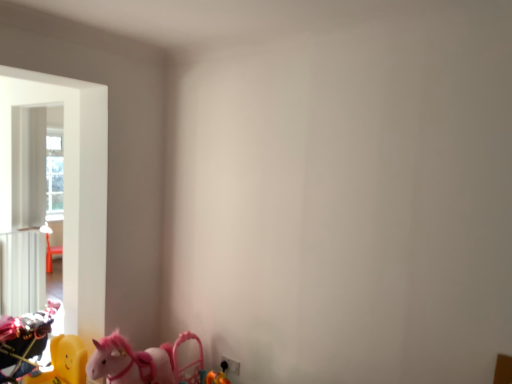
The height and width of the screenshot is (384, 512). What do you see at coordinates (24, 341) in the screenshot?
I see `shiny metallic motorcycle at left, which is counted as the 1th toy, starting from the left` at bounding box center [24, 341].

Where is `shiny metallic motorcycle at left, which is counted as the 1th toy, starting from the left`? The image size is (512, 384). shiny metallic motorcycle at left, which is counted as the 1th toy, starting from the left is located at coordinates point(24,341).

This screenshot has height=384, width=512. Describe the element at coordinates (64, 362) in the screenshot. I see `yellow plastic toy horse at lower left, positioned as the 1th toy in right-to-left order` at that location.

Where is `yellow plastic toy horse at lower left, positioned as the 1th toy in right-to-left order`? This screenshot has width=512, height=384. yellow plastic toy horse at lower left, positioned as the 1th toy in right-to-left order is located at coordinates (64, 362).

How much space does yellow plastic toy horse at lower left, positioned as the 1th toy in right-to-left order, occupy vertically?

The height of yellow plastic toy horse at lower left, positioned as the 1th toy in right-to-left order, is 15.76 inches.

Image resolution: width=512 pixels, height=384 pixels. What are the coordinates of `shiny metallic motorcycle at left, which is counted as the 1th toy, starting from the left` in the screenshot? It's located at (24, 341).

Is shiny metallic motorcycle at left, which is counted as the 1th toy, starting from the left, at the left side of yellow plastic toy horse at lower left, positioned as the 1th toy in right-to-left order?

Yes, shiny metallic motorcycle at left, which is counted as the 1th toy, starting from the left, is to the left of yellow plastic toy horse at lower left, positioned as the 1th toy in right-to-left order.

Is shiny metallic motorcycle at left, which is counted as the 1th toy, starting from the left, further to the viewer compared to yellow plastic toy horse at lower left, positioned as the 1th toy in right-to-left order?

Yes, the depth of shiny metallic motorcycle at left, which is counted as the 1th toy, starting from the left, is greater than that of yellow plastic toy horse at lower left, positioned as the 1th toy in right-to-left order.

Considering the points (2, 366) and (69, 380), which point is in front, point (2, 366) or point (69, 380)?

The point (69, 380) is closer.

From the image's perspective, is shiny metallic motorcycle at left, which is counted as the 1th toy, starting from the left, located above or below yellow plastic toy horse at lower left, the 2th toy when ordered from left to right?

shiny metallic motorcycle at left, which is counted as the 1th toy, starting from the left, is situated higher than yellow plastic toy horse at lower left, the 2th toy when ordered from left to right, in the image.

From a real-world perspective, between shiny metallic motorcycle at left, which is counted as the 1th toy, starting from the left, and yellow plastic toy horse at lower left, positioned as the 1th toy in right-to-left order, who is vertically lower?

In real-world perspective, yellow plastic toy horse at lower left, positioned as the 1th toy in right-to-left order, is lower.

Looking at their sizes, would you say shiny metallic motorcycle at left, which is counted as the 1th toy, starting from the left, is wider or thinner than yellow plastic toy horse at lower left, positioned as the 1th toy in right-to-left order?

shiny metallic motorcycle at left, which is counted as the 1th toy, starting from the left, is wider than yellow plastic toy horse at lower left, positioned as the 1th toy in right-to-left order.

Does shiny metallic motorcycle at left, which is counted as the 1th toy, starting from the left, have a lesser height compared to yellow plastic toy horse at lower left, positioned as the 1th toy in right-to-left order?

No.

Which of these two, shiny metallic motorcycle at left, which is counted as the 2th toy, starting from the right, or yellow plastic toy horse at lower left, the 2th toy when ordered from left to right, is bigger?

shiny metallic motorcycle at left, which is counted as the 2th toy, starting from the right.

Is shiny metallic motorcycle at left, which is counted as the 1th toy, starting from the left, situated inside yellow plastic toy horse at lower left, positioned as the 1th toy in right-to-left order, or outside?

shiny metallic motorcycle at left, which is counted as the 1th toy, starting from the left, is not enclosed by yellow plastic toy horse at lower left, positioned as the 1th toy in right-to-left order.

Is shiny metallic motorcycle at left, which is counted as the 2th toy, starting from the right, in contact with yellow plastic toy horse at lower left, positioned as the 1th toy in right-to-left order?

No.

Is yellow plastic toy horse at lower left, the 2th toy when ordered from left to right, at the back of shiny metallic motorcycle at left, which is counted as the 1th toy, starting from the left?

shiny metallic motorcycle at left, which is counted as the 1th toy, starting from the left, is not turned away from yellow plastic toy horse at lower left, the 2th toy when ordered from left to right.

How many degrees apart are the facing directions of shiny metallic motorcycle at left, which is counted as the 1th toy, starting from the left, and yellow plastic toy horse at lower left, positioned as the 1th toy in right-to-left order?

0.00112 degrees separate the facing orientations of shiny metallic motorcycle at left, which is counted as the 1th toy, starting from the left, and yellow plastic toy horse at lower left, positioned as the 1th toy in right-to-left order.

How far apart are shiny metallic motorcycle at left, which is counted as the 1th toy, starting from the left, and yellow plastic toy horse at lower left, positioned as the 1th toy in right-to-left order?

shiny metallic motorcycle at left, which is counted as the 1th toy, starting from the left, and yellow plastic toy horse at lower left, positioned as the 1th toy in right-to-left order, are 8.74 inches apart from each other.

This screenshot has height=384, width=512. In the image, there is a shiny metallic motorcycle at left, which is counted as the 1th toy, starting from the left. Identify the location of toy below it (from the image's perspective). (64, 362).

Is yellow plastic toy horse at lower left, the 2th toy when ordered from left to right, to the right of shiny metallic motorcycle at left, which is counted as the 1th toy, starting from the left, from the viewer's perspective?

Yes.

Is the position of yellow plastic toy horse at lower left, the 2th toy when ordered from left to right, less distant than that of shiny metallic motorcycle at left, which is counted as the 2th toy, starting from the right?

Yes, the depth of yellow plastic toy horse at lower left, the 2th toy when ordered from left to right, is less than that of shiny metallic motorcycle at left, which is counted as the 2th toy, starting from the right.

Which point is more distant from viewer, (78, 353) or (50, 300)?

Point (50, 300)

From the image's perspective, is yellow plastic toy horse at lower left, positioned as the 1th toy in right-to-left order, located above or below shiny metallic motorcycle at left, which is counted as the 2th toy, starting from the right?

yellow plastic toy horse at lower left, positioned as the 1th toy in right-to-left order, is situated lower than shiny metallic motorcycle at left, which is counted as the 2th toy, starting from the right, in the image.

From a real-world perspective, which is physically above, yellow plastic toy horse at lower left, positioned as the 1th toy in right-to-left order, or shiny metallic motorcycle at left, which is counted as the 1th toy, starting from the left?

shiny metallic motorcycle at left, which is counted as the 1th toy, starting from the left.

In terms of width, does yellow plastic toy horse at lower left, the 2th toy when ordered from left to right, look wider or thinner when compared to shiny metallic motorcycle at left, which is counted as the 2th toy, starting from the right?

In the image, yellow plastic toy horse at lower left, the 2th toy when ordered from left to right, appears to be more narrow than shiny metallic motorcycle at left, which is counted as the 2th toy, starting from the right.

Can you confirm if yellow plastic toy horse at lower left, positioned as the 1th toy in right-to-left order, is shorter than shiny metallic motorcycle at left, which is counted as the 1th toy, starting from the left?

Yes.

Is yellow plastic toy horse at lower left, positioned as the 1th toy in right-to-left order, smaller than shiny metallic motorcycle at left, which is counted as the 1th toy, starting from the left?

Yes, yellow plastic toy horse at lower left, positioned as the 1th toy in right-to-left order, is smaller than shiny metallic motorcycle at left, which is counted as the 1th toy, starting from the left.

In the scene shown: Is shiny metallic motorcycle at left, which is counted as the 1th toy, starting from the left, surrounded by yellow plastic toy horse at lower left, the 2th toy when ordered from left to right?

That's incorrect, shiny metallic motorcycle at left, which is counted as the 1th toy, starting from the left, is not inside yellow plastic toy horse at lower left, the 2th toy when ordered from left to right.

Is the surface of yellow plastic toy horse at lower left, positioned as the 1th toy in right-to-left order, in direct contact with shiny metallic motorcycle at left, which is counted as the 1th toy, starting from the left?

No, yellow plastic toy horse at lower left, positioned as the 1th toy in right-to-left order, is not beside shiny metallic motorcycle at left, which is counted as the 1th toy, starting from the left.

Is yellow plastic toy horse at lower left, positioned as the 1th toy in right-to-left order, aimed at shiny metallic motorcycle at left, which is counted as the 2th toy, starting from the right?

No, yellow plastic toy horse at lower left, positioned as the 1th toy in right-to-left order, is not aimed at shiny metallic motorcycle at left, which is counted as the 2th toy, starting from the right.

Can you tell me how much yellow plastic toy horse at lower left, positioned as the 1th toy in right-to-left order, and shiny metallic motorcycle at left, which is counted as the 2th toy, starting from the right, differ in facing direction?

0.00112 degrees.

How distant is yellow plastic toy horse at lower left, positioned as the 1th toy in right-to-left order, from shiny metallic motorcycle at left, which is counted as the 1th toy, starting from the left?

They are 8.74 inches apart.

This screenshot has width=512, height=384. In order to click on toy that is on the left side of yellow plastic toy horse at lower left, positioned as the 1th toy in right-to-left order in this screenshot , I will do pos(24,341).

Find the location of a particular element. The width and height of the screenshot is (512, 384). toy located behind the yellow plastic toy horse at lower left, positioned as the 1th toy in right-to-left order is located at coordinates (24, 341).

Find the location of `toy in front of the shiny metallic motorcycle at left, which is counted as the 1th toy, starting from the left`. toy in front of the shiny metallic motorcycle at left, which is counted as the 1th toy, starting from the left is located at coordinates (64, 362).